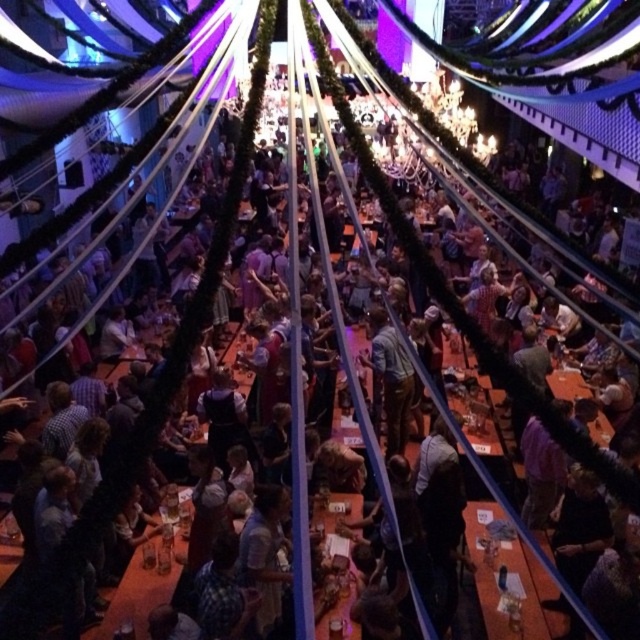
Looking at this image, you are standing at the entrance of the event venue and want to find the wooden table at lower right. According to the coordinates provided, where should you look to locate it?

The wooden table at lower right is located at coordinates point (x=508, y=579), so you should look towards the lower right area of the image to find it.

You are standing at the entrance of the event venue and see two points marked in the image. The first point is at coordinate point(515, 541) and the second is at point(321, 528). Which point is closer to you?

Point(515, 541) is in front of point(321, 528), so the first point is closer to you.

You are a guest at the event and need to reach the wooden table at lower right from the wooden table at center. Since you are 1.7 meters tall, will you have to bend down to reach the lower table?

The wooden table at lower right is not as tall as the wooden table at center. Since you are 1.7 meters tall, you will need to bend down to reach the wooden table at lower right because it is shorter than the center table, which may be at a standard height.